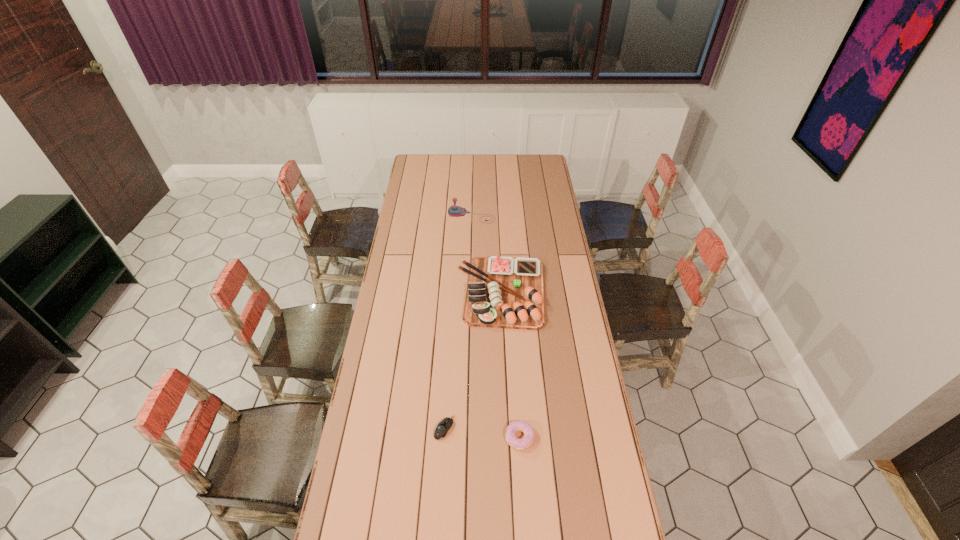
Image resolution: width=960 pixels, height=540 pixels. In order to click on object that is positioned at the right edge in this screenshot , I will do `click(502, 292)`.

You are a GUI agent. You are given a task and a screenshot of the screen. Output one action in this format:
    pyautogui.click(x=<x>, y=<y>)
    Task: Click on the blank space at the far edge
    
    Given the screenshot: What is the action you would take?
    pyautogui.click(x=439, y=156)

You are a GUI agent. You are given a task and a screenshot of the screen. Output one action in this format:
    pyautogui.click(x=<x>, y=<y>)
    Task: Click on the free space at the left edge
    The height and width of the screenshot is (540, 960).
    Given the screenshot: What is the action you would take?
    pyautogui.click(x=393, y=307)

In the image, there is a desktop. At what (x,y) coordinates should I click in order to perform the action: click on vacant space at the right edge. Please return your answer as a coordinate pair (x, y). Looking at the image, I should click on (546, 218).

Locate an element on the screen. The height and width of the screenshot is (540, 960). unoccupied position between the shortest object and the platter is located at coordinates (473, 360).

At what (x,y) coordinates should I click in order to perform the action: click on unoccupied area between the farthest object and the platter. Please return your answer as a coordinate pair (x, y). Looking at the image, I should click on (487, 254).

Find the location of `empty location between the farthest object and the shortest object`. empty location between the farthest object and the shortest object is located at coordinates (458, 322).

The height and width of the screenshot is (540, 960). I want to click on free space between the computer mouse and the tallest object, so click(458, 322).

At what (x,y) coordinates should I click in order to perform the action: click on free spot between the farthest object and the second tallest object. Please return your answer as a coordinate pair (x, y). This screenshot has width=960, height=540. Looking at the image, I should click on [x=487, y=254].

Where is `free space that is in between the third shortest object and the shortest object`? Image resolution: width=960 pixels, height=540 pixels. free space that is in between the third shortest object and the shortest object is located at coordinates (473, 360).